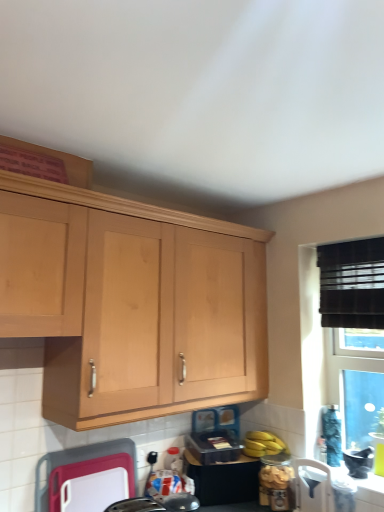
Question: Is yellow matte bananas at lower right in front of light wood cabinet at upper left?

Choices:
 (A) yes
 (B) no

Answer: (B)

Question: From a real-world perspective, is yellow matte bananas at lower right located beneath light wood cabinet at upper left?

Choices:
 (A) no
 (B) yes

Answer: (B)

Question: Is yellow matte bananas at lower right to the left of light wood cabinet at upper left from the viewer's perspective?

Choices:
 (A) no
 (B) yes

Answer: (A)

Question: Is yellow matte bananas at lower right to the right of light wood cabinet at upper left from the viewer's perspective?

Choices:
 (A) yes
 (B) no

Answer: (A)

Question: Is yellow matte bananas at lower right far away from light wood cabinet at upper left?

Choices:
 (A) no
 (B) yes

Answer: (A)

Question: From the image's perspective, is yellow matte bananas at lower right on top of light wood cabinet at upper left?

Choices:
 (A) yes
 (B) no

Answer: (B)

Question: Is yellow matte bananas at lower right at the back of white plastic chair at lower right, the 3th appliance positioned from the left?

Choices:
 (A) no
 (B) yes

Answer: (A)

Question: From a real-world perspective, is white plastic chair at lower right, the 3th appliance positioned from the left, located higher than yellow matte bananas at lower right?

Choices:
 (A) yes
 (B) no

Answer: (B)

Question: Does white plastic chair at lower right, the 3th appliance positioned from the left, appear on the right side of yellow matte bananas at lower right?

Choices:
 (A) no
 (B) yes

Answer: (B)

Question: Is white plastic chair at lower right, the 3th appliance positioned from the left, taller than yellow matte bananas at lower right?

Choices:
 (A) yes
 (B) no

Answer: (A)

Question: From the image's perspective, would you say white plastic chair at lower right, marked as the 1th appliance in a right-to-left arrangement, is shown under yellow matte bananas at lower right?

Choices:
 (A) no
 (B) yes

Answer: (B)

Question: Is white plastic chair at lower right, the 3th appliance positioned from the left, smaller than yellow matte bananas at lower right?

Choices:
 (A) no
 (B) yes

Answer: (B)

Question: Is yellow matte bananas at lower right closer to the viewer compared to white plastic chair at lower right, marked as the 1th appliance in a right-to-left arrangement?

Choices:
 (A) no
 (B) yes

Answer: (A)